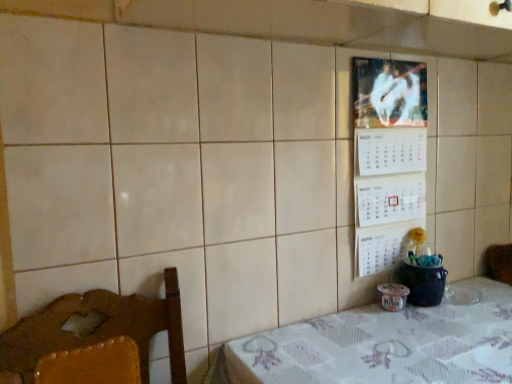
Image resolution: width=512 pixels, height=384 pixels. In order to click on vacant area on top of white fabric table at lower right (from a real-world perspective) in this screenshot , I will do `click(378, 342)`.